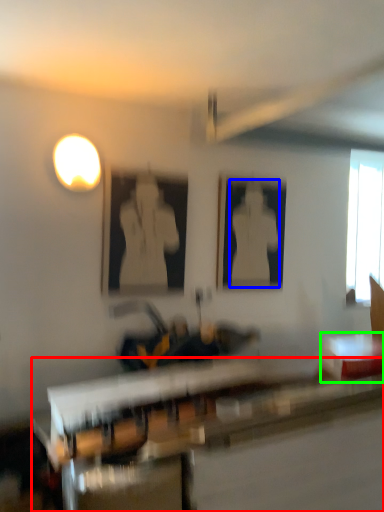
Question: Considering the real-world distances, which object is farthest from table (highlighted by a red box)? person (highlighted by a blue box) or table (highlighted by a green box)?

Choices:
 (A) person
 (B) table

Answer: (A)